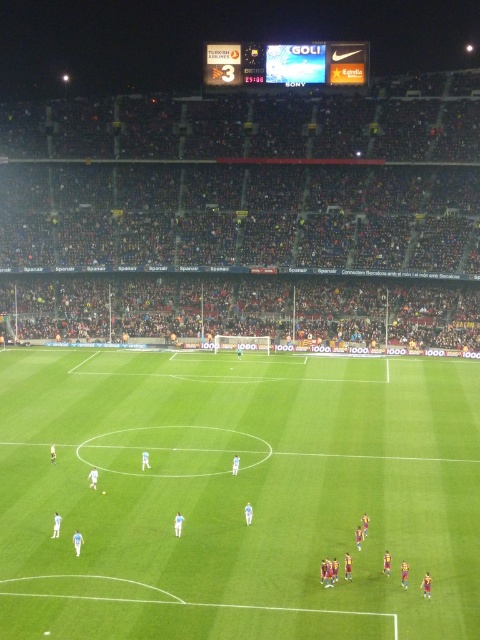
Who is lower down, green grass field at center or maroon jersey players at center?

maroon jersey players at center is lower down.

Which is more to the right, green grass field at center or maroon jersey players at center?

green grass field at center

At what (x,y) coordinates should I click in order to perform the action: click on green grass field at center. Please return your answer as a coordinate pair (x, y). The height and width of the screenshot is (640, 480). Looking at the image, I should click on (238, 496).

Locate an element on the screen. The width and height of the screenshot is (480, 640). green grass field at center is located at coordinates (238, 496).